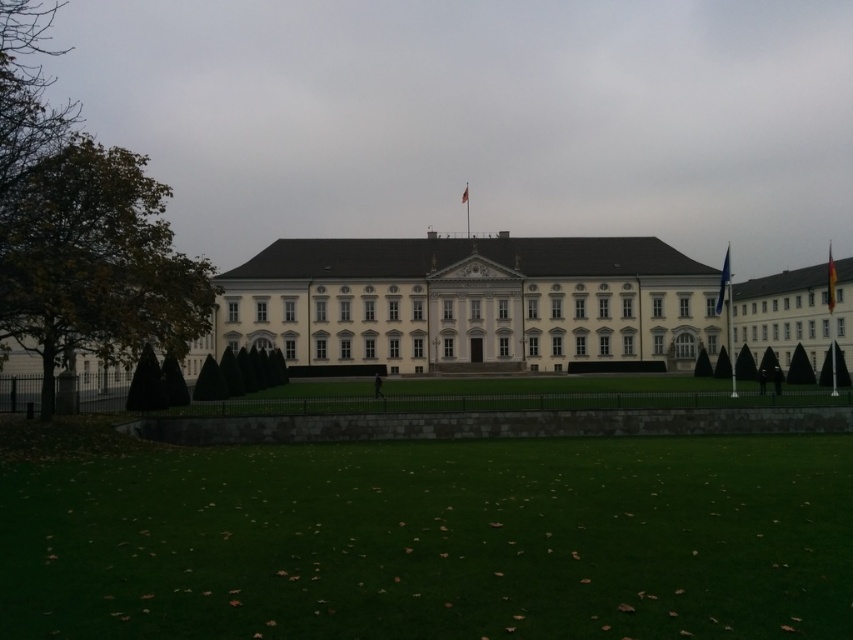
You are standing in front of the building and want to take a photo. You notice two points marked on the ground at coordinates point (460,560) and point (111,193). Which point is closer to your current position?

Point (460,560) is closer to the camera than point (111,193), so the point closer to your current position is point (460,560).

What is the position of the green grass at lower center relative to the green leafy tree at left?

The green grass at lower center is to the right of the green leafy tree at left.

You are a landscape architect designing a pathway between the green grass at lower center and the green leafy tree at left. Which area should the pathway be wider to accommodate more visitors, and why?

The pathway should be wider in the area of the green grass at lower center because its width surpasses that of the green leafy tree at left, providing more space for visitors to move comfortably.